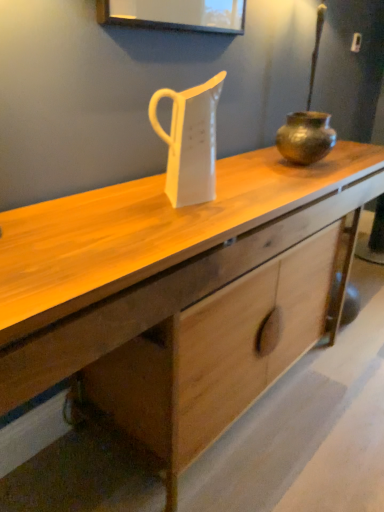
Question: Would you say bronze textured pot at center is inside or outside white glossy jug at center?

Choices:
 (A) outside
 (B) inside

Answer: (A)

Question: Is bronze textured pot at center in front of or behind white glossy jug at center in the image?

Choices:
 (A) front
 (B) behind

Answer: (B)

Question: Which object is positioned farthest from the white glossy jug at center?

Choices:
 (A) bronze metallic pot at right
 (B) bronze textured pot at center
 (C) wooden desk at center

Answer: (A)

Question: Estimate the real-world distances between objects in this image. Which object is closer to the wooden desk at center?

Choices:
 (A) white glossy jug at center
 (B) bronze metallic pot at right
 (C) bronze textured pot at center

Answer: (A)